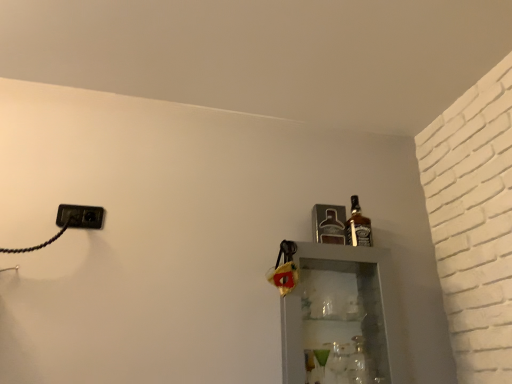
Question: Considering the positions of metallic silver bottle at upper right, arranged as the 2th bottle when viewed from the top, and black plastic outlet at left in the image, is metallic silver bottle at upper right, arranged as the 2th bottle when viewed from the top, taller or shorter than black plastic outlet at left?

Choices:
 (A) short
 (B) tall

Answer: (B)

Question: Looking at the image, does metallic silver bottle at upper right, arranged as the 2th bottle when viewed from the top, seem bigger or smaller compared to black plastic outlet at left?

Choices:
 (A) big
 (B) small

Answer: (A)

Question: Estimate the real-world distances between objects in this image. Which object is farther from the metallic silver bottle at upper right, arranged as the 2th bottle when viewed from the top?

Choices:
 (A) black plastic outlet at left
 (B) brown glass bottle at upper right, marked as the third bottle in a bottom-to-top arrangement
 (C) clear glass bottle at right, marked as the third bottle in a top-to-bottom arrangement

Answer: (A)

Question: Based on their relative distances, which object is farther from the black plastic outlet at left?

Choices:
 (A) brown glass bottle at upper right, marked as the 1th bottle in a top-to-bottom arrangement
 (B) clear glass bottle at right, marked as the third bottle in a top-to-bottom arrangement
 (C) metallic silver bottle at upper right, arranged as the 2th bottle when viewed from the top

Answer: (B)